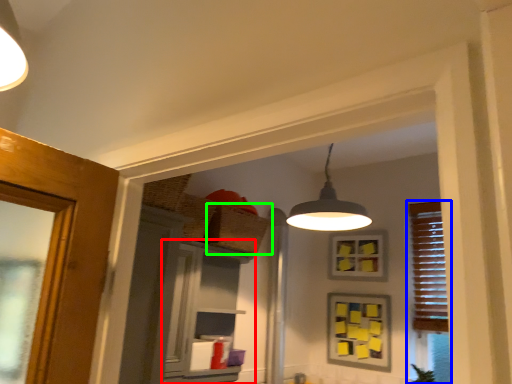
Question: Based on their relative distances, which object is nearer to cabinetry (highlighted by a red box)? Choose from window (highlighted by a blue box) and basket (highlighted by a green box).

Choices:
 (A) window
 (B) basket

Answer: (B)